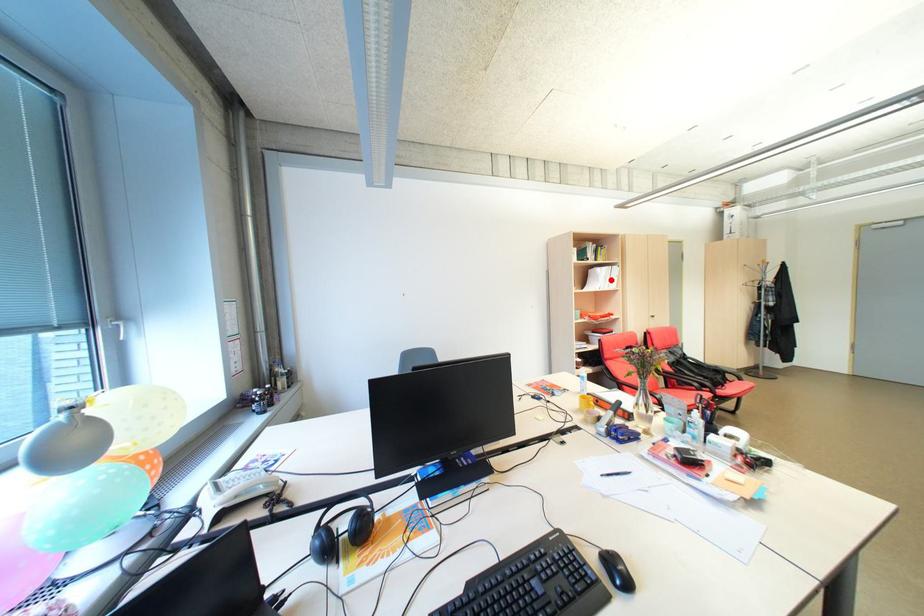
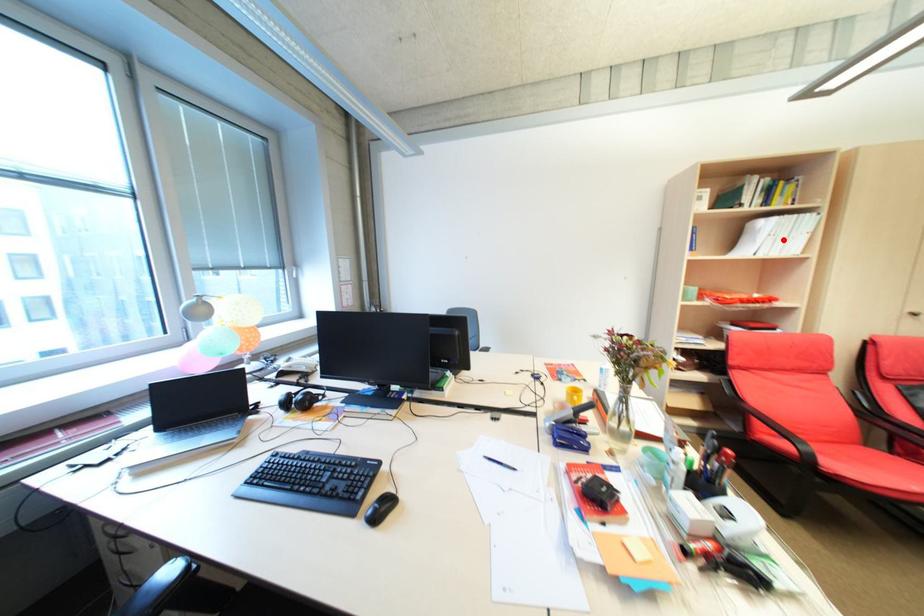
I am providing you with two images of the same scene from different viewpoints. A red point is marked on the first image and another point is marked on the second image. Is the marked point in image1 the same physical position as the marked point in image2?

Yes